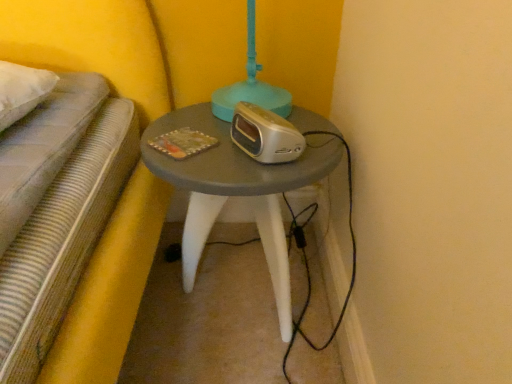
Question: Does matte gray table at center appear on the right side of silver metallic alarm clock at center?

Choices:
 (A) yes
 (B) no

Answer: (B)

Question: Can you confirm if matte gray table at center is wider than silver metallic alarm clock at center?

Choices:
 (A) yes
 (B) no

Answer: (A)

Question: Does matte gray table at center lie in front of silver metallic alarm clock at center?

Choices:
 (A) yes
 (B) no

Answer: (B)

Question: Is matte gray table at center further to the viewer compared to silver metallic alarm clock at center?

Choices:
 (A) no
 (B) yes

Answer: (B)

Question: Is matte gray table at center positioned far away from silver metallic alarm clock at center?

Choices:
 (A) yes
 (B) no

Answer: (B)

Question: Can you confirm if matte gray table at center is smaller than silver metallic alarm clock at center?

Choices:
 (A) yes
 (B) no

Answer: (B)

Question: From the image's perspective, is silver metallic alarm clock at center located above matte gray table at center?

Choices:
 (A) yes
 (B) no

Answer: (A)

Question: Can you confirm if silver metallic alarm clock at center is bigger than matte gray table at center?

Choices:
 (A) yes
 (B) no

Answer: (B)

Question: Does silver metallic alarm clock at center lie in front of matte gray table at center?

Choices:
 (A) yes
 (B) no

Answer: (A)

Question: Can you confirm if silver metallic alarm clock at center is thinner than matte gray table at center?

Choices:
 (A) yes
 (B) no

Answer: (A)

Question: From the image's perspective, is silver metallic alarm clock at center beneath matte gray table at center?

Choices:
 (A) no
 (B) yes

Answer: (A)

Question: From a real-world perspective, does silver metallic alarm clock at center sit lower than matte gray table at center?

Choices:
 (A) no
 (B) yes

Answer: (A)

Question: Is silver metallic alarm clock at center wider or thinner than matte gray table at center?

Choices:
 (A) thin
 (B) wide

Answer: (A)